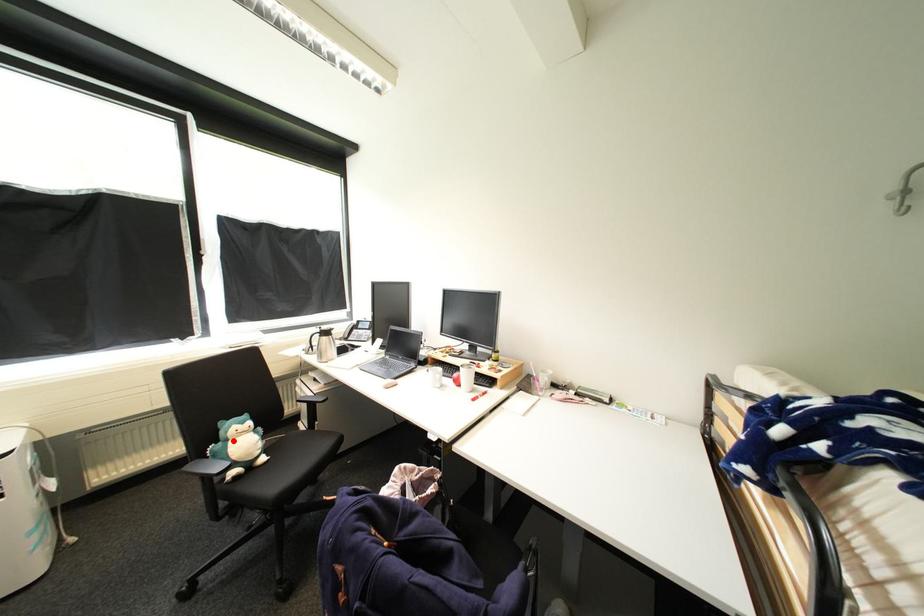
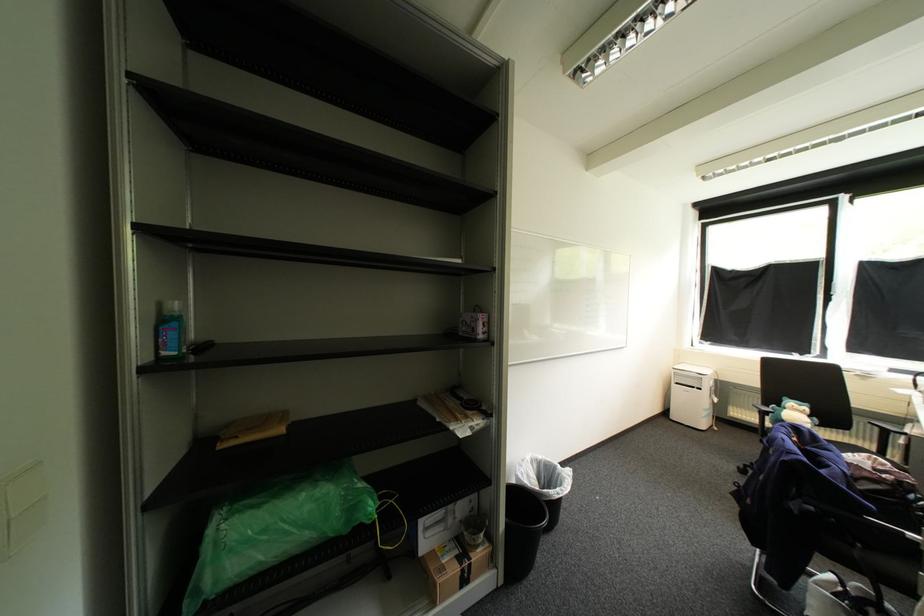
Find the pixel in the second image that matches the highlighted location in the first image.

(792, 408)